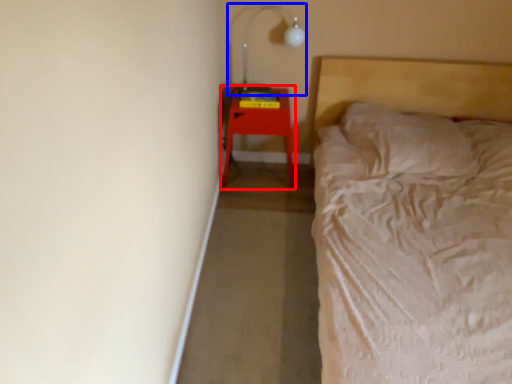
Question: Among these objects, which one is nearest to the camera, furniture (highlighted by a red box) or lamp (highlighted by a blue box)?

Choices:
 (A) furniture
 (B) lamp

Answer: (B)